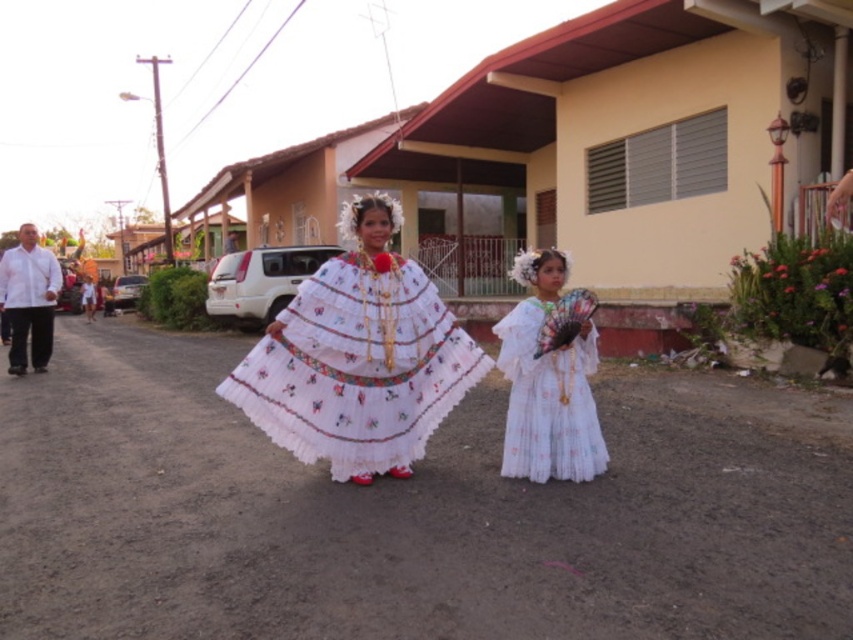
You are a photographer trying to capture both the white embroidered dress at center and the white cotton dress at center in the same frame. Given that the camera has a fixed focal length and limited horizontal space, which dress might require you to adjust your position to ensure both are fully visible?

The white embroidered dress at center has a larger width than the white cotton dress at center, so you might need to adjust your position to accommodate its wider size to ensure both are fully visible.

You are a photographer standing at the edge of the street. You want to take a photo of both the white embroidered dress at center and the white cotton dress at center. If your camera can capture objects within a 70 cm range, will both dresses fit in the frame?

The white embroidered dress at center is 68.05 centimeters away from the white cotton dress at center. Since the distance between them is less than 70 cm, both dresses will fit within the camera frame.